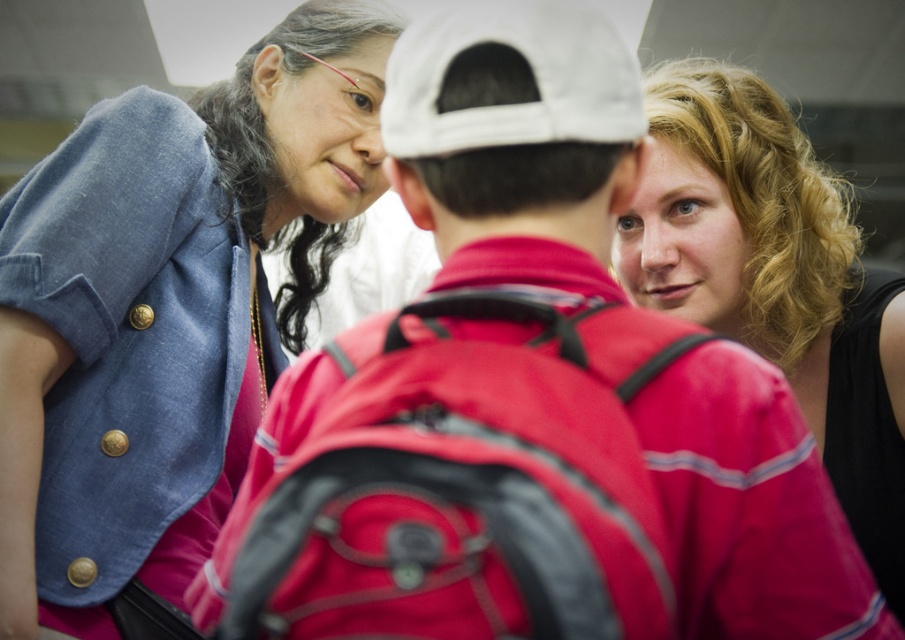
You are a photographer trying to capture a candid shot of the white fabric baseball cap at center and the blonde curly hair at upper right. Which object is positioned lower in the frame?

The blonde curly hair at upper right is located below the white fabric baseball cap at center, so the blonde curly hair at upper right is lower in the frame.

You are a photographer trying to capture a group photo of the denim jacket at upper left and the blonde curly hair at upper right. Which object should you position closer to the camera to ensure both are fully visible in the frame?

The denim jacket at upper left might be wider than blonde curly hair at upper right, so positioning the denim jacket at upper left closer to the camera would help ensure both fit within the frame.